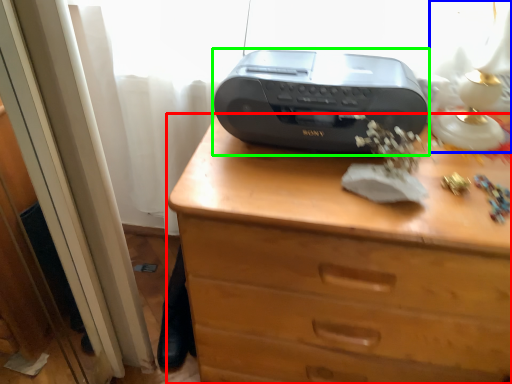
Question: Which object is the closest to the chest of drawers (highlighted by a red box)? Choose among these: table lamp (highlighted by a blue box) or printer (highlighted by a green box).

Choices:
 (A) table lamp
 (B) printer

Answer: (B)